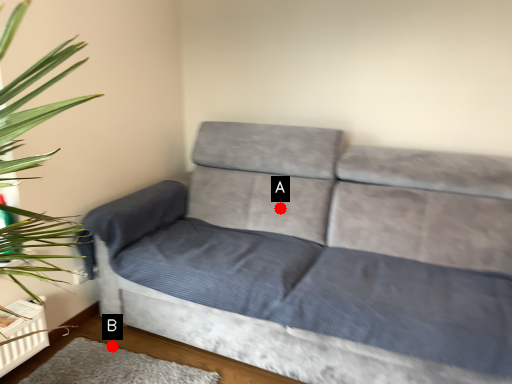
Question: Two points are circled on the image, labeled by A and B beside each circle. Which point is closer to the camera?

Choices:
 (A) A is closer
 (B) B is closer

Answer: (B)